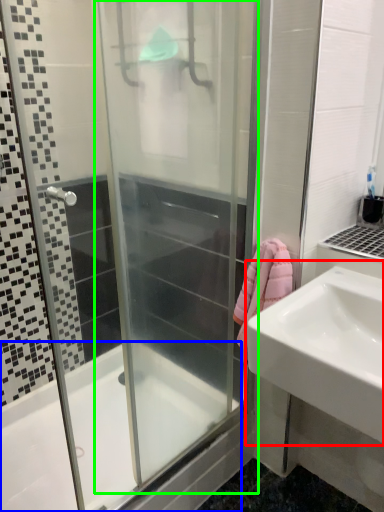
Question: Estimate the real-world distances between objects in this image. Which object is closer to sink (highlighted by a red box), bathtub (highlighted by a blue box) or screen door (highlighted by a green box)?

Choices:
 (A) bathtub
 (B) screen door

Answer: (B)